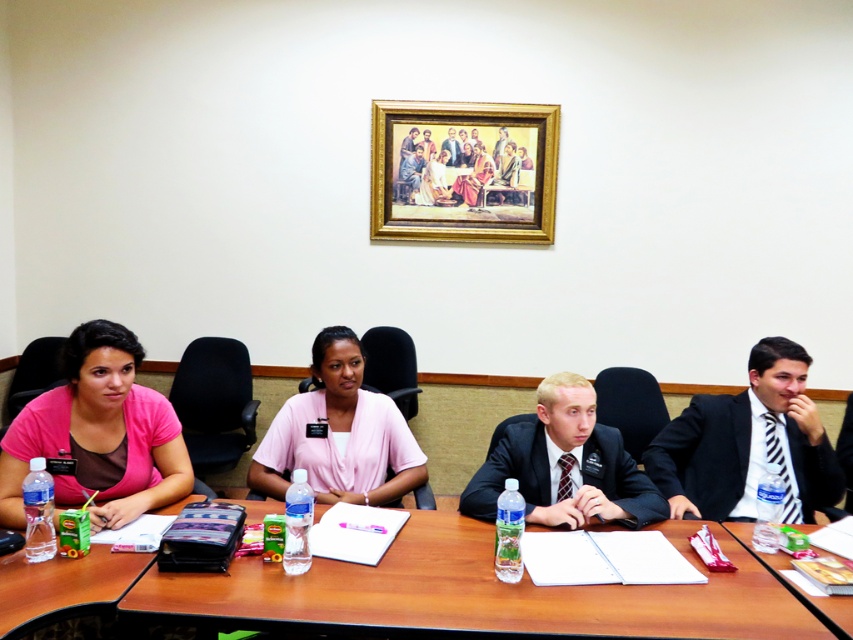
You are an attendee at this meeting and need to pass a note to the person wearing the pink matte shirt at left without being noticed. Since you are sitting at the smooth brown suit at center, which direction should you lean to discreetly pass the note?

The pink matte shirt at left is positioned under the smooth brown suit at center, so you should lean to your left to discreetly pass the note to the person wearing the pink matte shirt at left.

You are sitting at the table and need to pass a document to the person in the smooth brown suit at center. Which direction should you move the document to reach them from the pink matte shirt at left?

The pink matte shirt at left is to the left of the smooth brown suit at center, so you should move the document to the right to reach the smooth brown suit at center from the pink matte shirt at left.